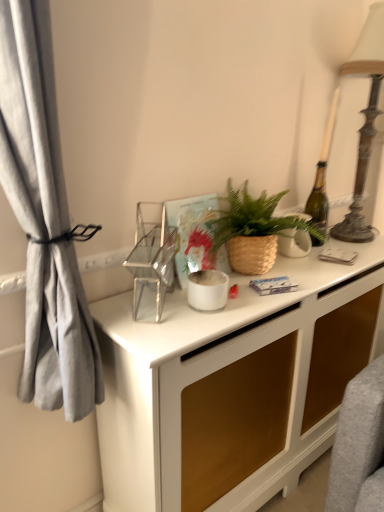
Where is `free spot to the right of white matte pot at center, marked as the second appliance in a front-to-back arrangement`? The image size is (384, 512). free spot to the right of white matte pot at center, marked as the second appliance in a front-to-back arrangement is located at coordinates (252, 304).